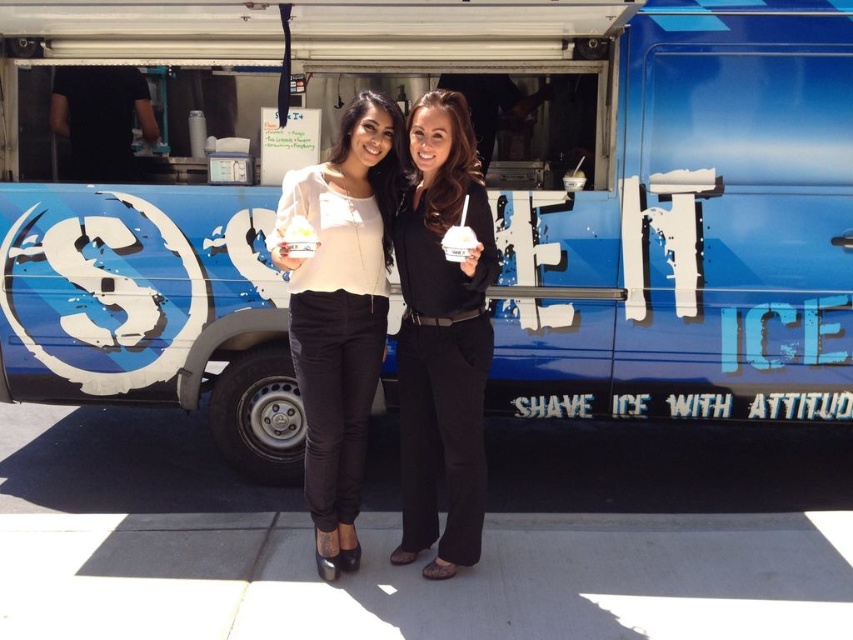
Question: Which of the following is the farthest from the observer?

Choices:
 (A) black matte pants at center
 (B) white matte ice cream cone at center

Answer: (A)

Question: Which of the following is the farthest from the observer?

Choices:
 (A) black matte pants at center
 (B) white matte ice cream cone at center
 (C) matte white blouse at center

Answer: (C)

Question: Is black matte pants at center above matte white blouse at center?

Choices:
 (A) no
 (B) yes

Answer: (A)

Question: Can you confirm if black matte pants at center is wider than matte white blouse at center?

Choices:
 (A) no
 (B) yes

Answer: (A)

Question: Is black matte pants at center bigger than white matte ice cream cone at center?

Choices:
 (A) yes
 (B) no

Answer: (A)

Question: Estimate the real-world distances between objects in this image. Which object is closer to the black matte pants at center?

Choices:
 (A) white matte ice cream cone at center
 (B) matte white blouse at center

Answer: (B)